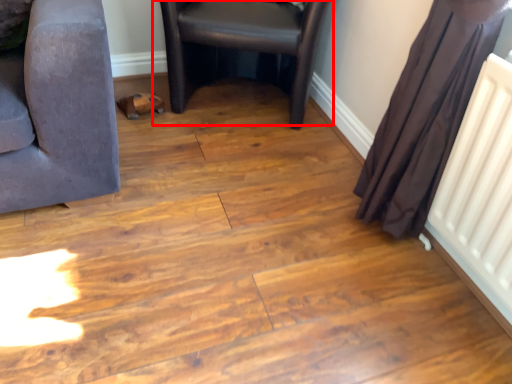
Question: From the image, what is the correct spatial relationship of chair (annotated by the red box) in relation to curtain?

Choices:
 (A) left
 (B) right

Answer: (A)